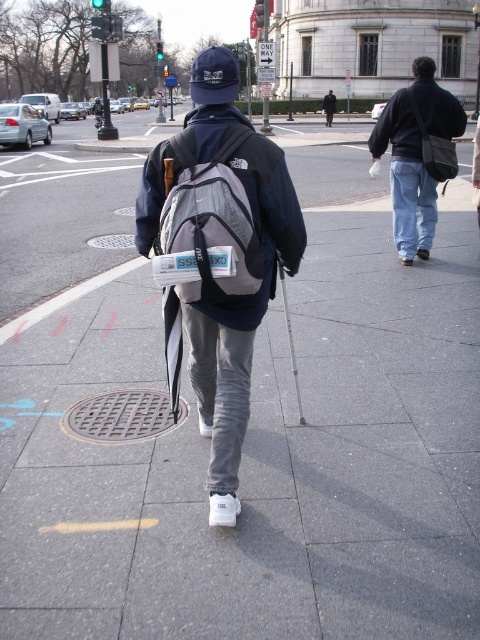
Consider the image. You are a delivery person who needs to deliver a package to the person holding the white cane. You see both the matte gray backpack at center and the gray mesh backpack at center. Which backpack is closer to the person holding the white cane?

The matte gray backpack at center is closer to the person holding the white cane because the gray mesh backpack at center is behind it.

You are a pedestrian navigating a city sidewalk. You see a person ahead wearing a denim jacket at center and carrying a matte gray backpack at center. Which item is positioned lower on their body?

The matte gray backpack at center is located below the denim jacket at center, so the matte gray backpack at center is positioned lower on their body.